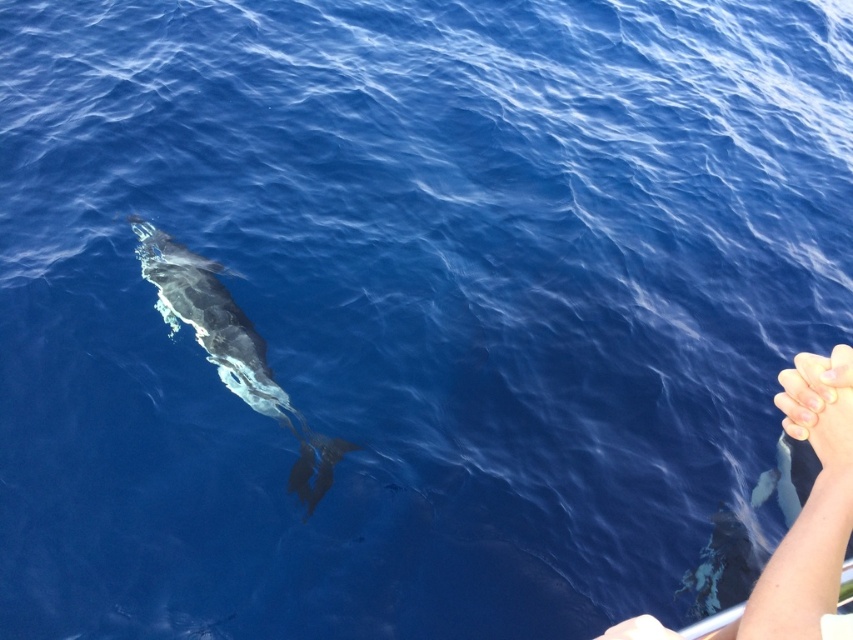
You are a swimmer trying to reach the gray smooth whale at center from the skinny white arm at lower right. Considering their sizes, which one would be easier to grab hold of?

The gray smooth whale at center is wider than the skinny white arm at lower right, so it would be easier to grab hold of the gray smooth whale at center.

You are a swimmer looking at the ocean scene. You see the skinny white arm at lower right and the gray smooth whale at center. Which object is located to the right side of the other?

The skinny white arm at lower right is located to the right of the gray smooth whale at center.

You are observing the ocean scene from above. You notice a skinny white arm at lower right and a gray smooth whale at center. Which object is closer to you?

The skinny white arm at lower right is closer to you because it is in front of the gray smooth whale at center.